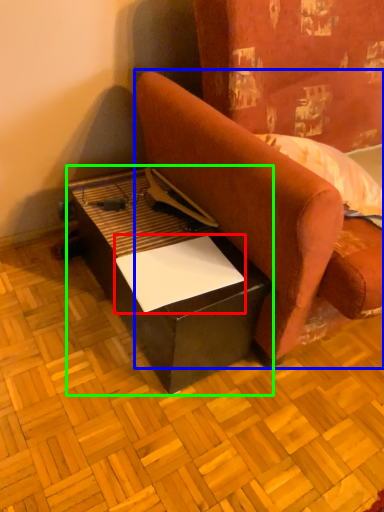
Question: Which object is positioned closest to paper (highlighted by a red box)? Select from studio couch (highlighted by a blue box) and table (highlighted by a green box).

Choices:
 (A) studio couch
 (B) table

Answer: (B)